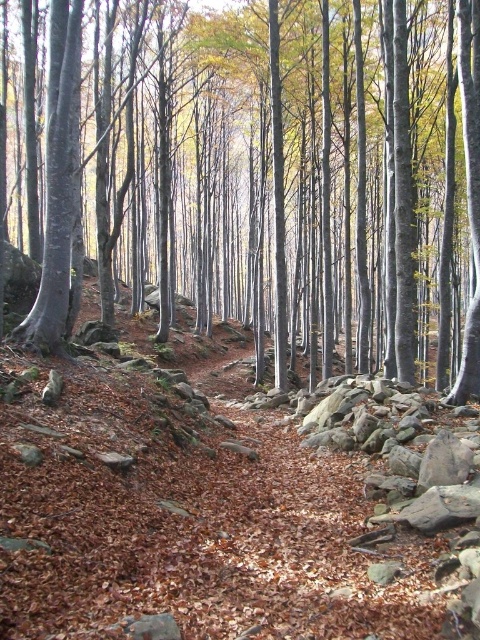
You are hiking through the forest and need to decide which area to cross first. Based on the image, which object, the brown wood forest at center or the brown leafy hillside at center, occupies a larger area?

The brown wood forest at center is bigger than the brown leafy hillside at center, so it occupies a larger area.

You are standing in the forest and want to walk towards the brown leafy hillside at center. Which direction should you move relative to the brown wood forest at center?

To reach the brown leafy hillside at center, you should move away from the brown wood forest at center since it is closer to you than the hillside.

You are standing in the forest and see the point marked as point (267, 173). What is located at that point?

The point (267, 173) corresponds to brown wood forest at center.